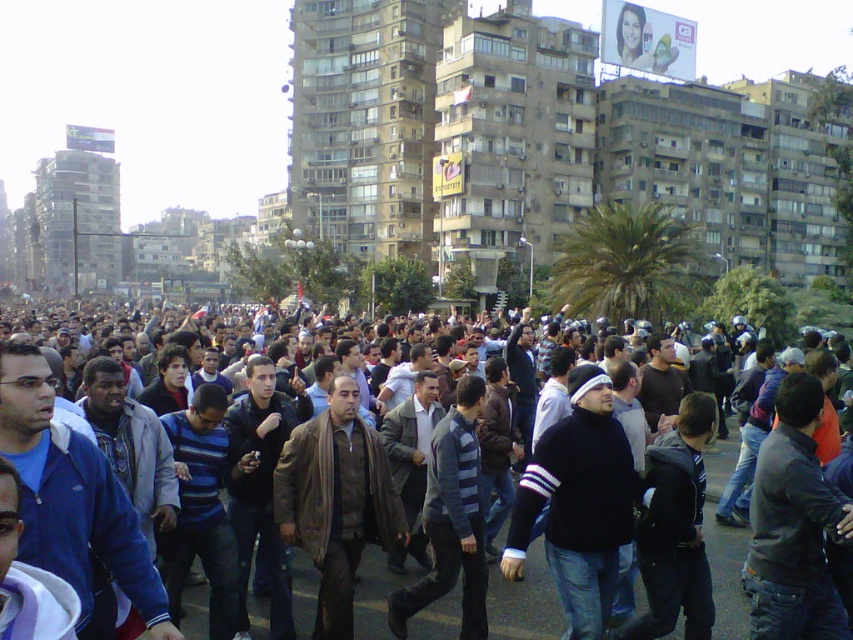
Who is more distant from viewer, (599, 422) or (337, 412)?

The point (337, 412) is behind.

Who is lower down, black matte sweater at center or brown leather jacket at center?

brown leather jacket at center is lower down.

Looking at this image, who is more distant from viewer, (587, 632) or (317, 602)?

Positioned behind is point (317, 602).

I want to click on black matte sweater at center, so click(x=578, y=502).

Which is in front, point (415, 628) or point (338, 564)?

Point (415, 628) is more forward.

Does dark brown leather jacket at center have a lesser height compared to brown leather jacket at center?

In fact, dark brown leather jacket at center may be taller than brown leather jacket at center.

Does point (299, 637) come closer to viewer compared to point (305, 522)?

Yes, it is in front of point (305, 522).

The height and width of the screenshot is (640, 853). Find the location of `dark brown leather jacket at center`. dark brown leather jacket at center is located at coordinates (724, 547).

In the scene shown: Can you confirm if black matte sweater at center is positioned to the right of dark brown leather jacket at center?

Yes, black matte sweater at center is to the right of dark brown leather jacket at center.

Is black matte sweater at center smaller than dark brown leather jacket at center?

Yes.

Is point (608, 464) more distant than point (379, 557)?

No, (608, 464) is closer to viewer.

Identify the location of black matte sweater at center. (578, 502).